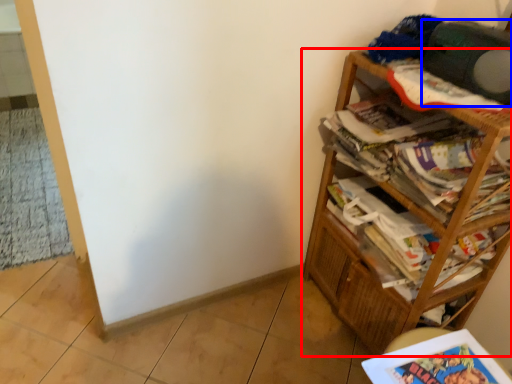
Question: Among these objects, which one is farthest to the camera, bookcase (highlighted by a red box) or speaker (highlighted by a blue box)?

Choices:
 (A) bookcase
 (B) speaker

Answer: (B)